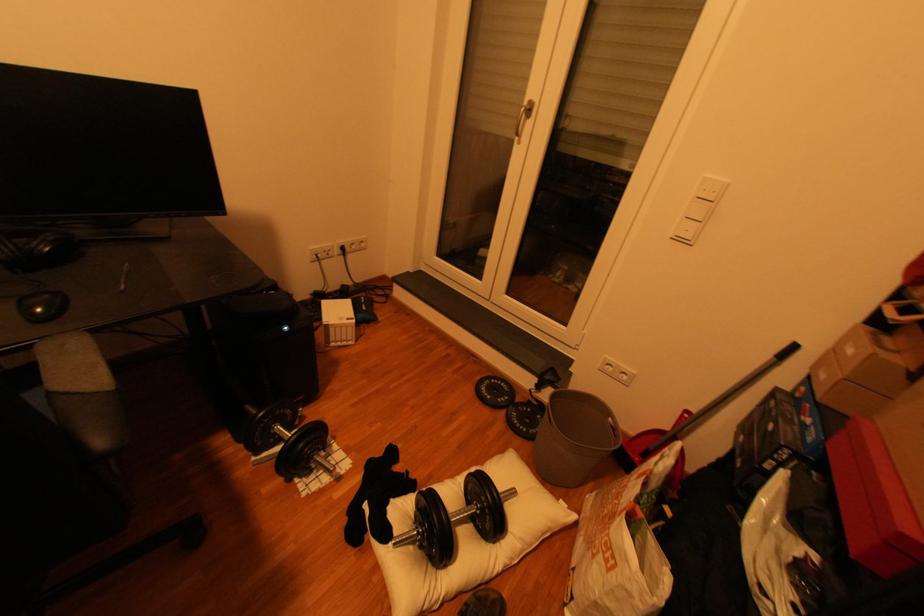
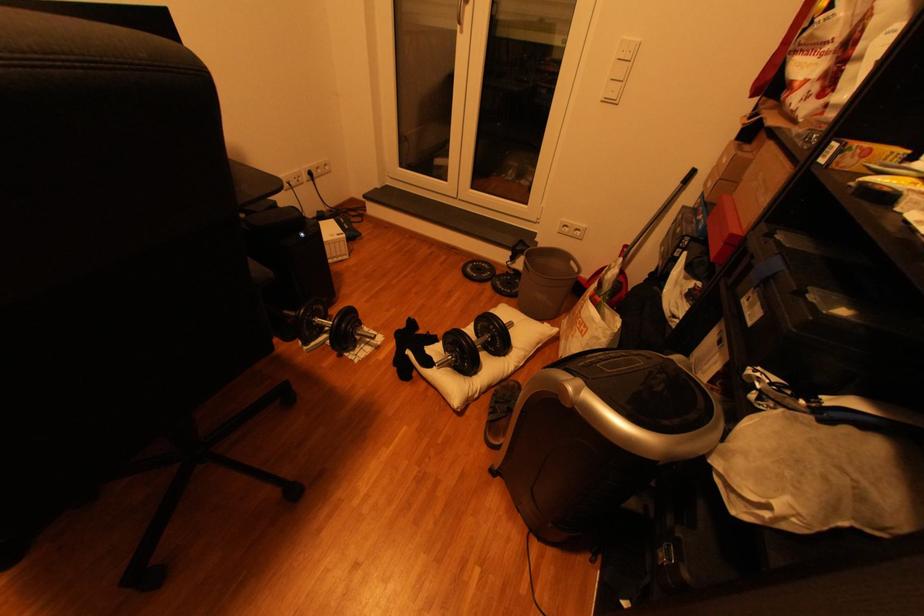
Question: I am providing you with two images of the same scene from different viewpoints. Which of the following objects are not visible in image2?

Choices:
 (A) white light switch
 (B) black weight plate
 (C) black computer mouse
 (D) black nike backpack

Answer: (C)